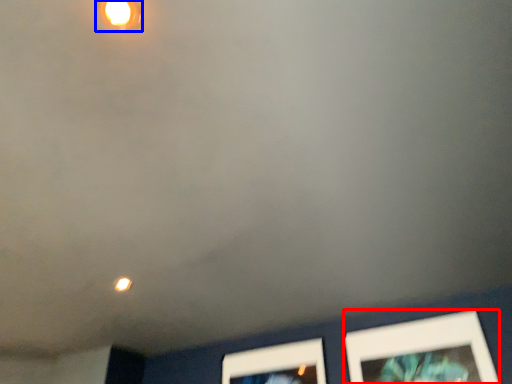
Question: Among these objects, which one is nearest to the camera, picture frame (highlighted by a red box) or light fixture (highlighted by a blue box)?

Choices:
 (A) picture frame
 (B) light fixture

Answer: (B)